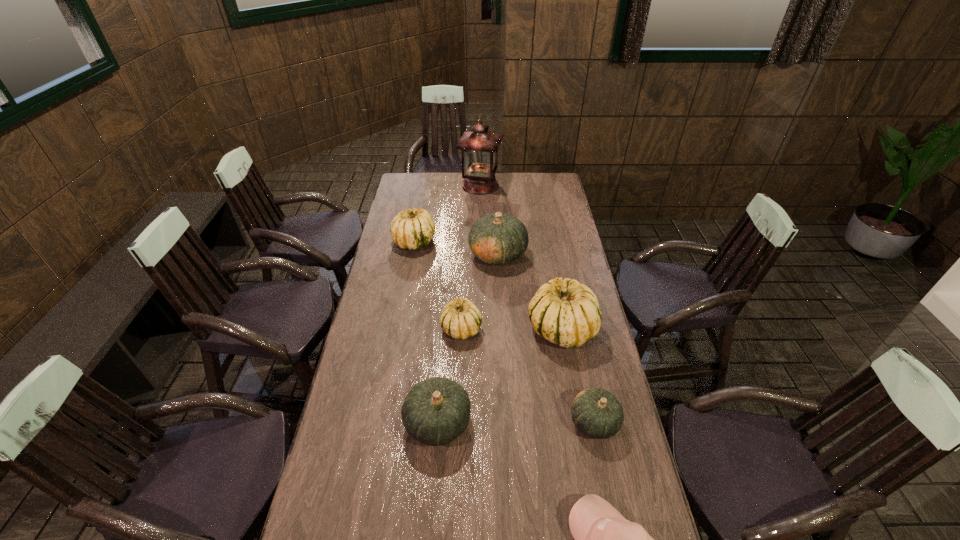
This screenshot has width=960, height=540. What are the coordinates of `vacant space situated 0.150m on the back of the biggest orange gourd` in the screenshot? It's located at (496, 219).

The height and width of the screenshot is (540, 960). Identify the location of free space located on the front of the biggest white gourd. (586, 460).

The image size is (960, 540). Identify the location of vacant area situated 0.210m on the left of the second smallest orange gourd. (338, 422).

This screenshot has height=540, width=960. In order to click on vacant region located 0.330m on the back of the farthest white gourd in this screenshot , I will do `click(423, 193)`.

The width and height of the screenshot is (960, 540). In order to click on free spot located on the back of the rightmost orange gourd in this screenshot , I will do `click(574, 327)`.

Where is `vacant position located on the front of the second white gourd from right to left`? This screenshot has height=540, width=960. vacant position located on the front of the second white gourd from right to left is located at coordinates (458, 404).

At what (x,y) coordinates should I click in order to perform the action: click on object located in the far edge section of the desktop. Please return your answer as a coordinate pair (x, y). Image resolution: width=960 pixels, height=540 pixels. Looking at the image, I should click on (479, 148).

Find the location of `object at the left edge`. object at the left edge is located at coordinates (411, 229).

Identify the location of vacant space at the far edge of the desktop. The height and width of the screenshot is (540, 960). (437, 187).

Identify the location of blank space at the right edge of the desktop. The width and height of the screenshot is (960, 540). (545, 224).